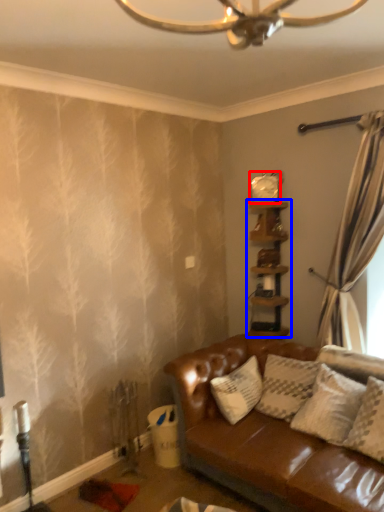
Question: Among these objects, which one is nearest to the camera, clock (highlighted by a red box) or shelf (highlighted by a blue box)?

Choices:
 (A) clock
 (B) shelf

Answer: (B)